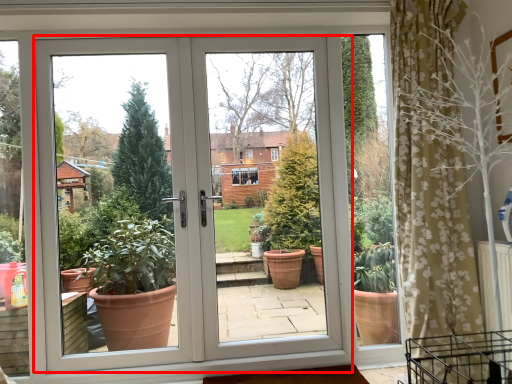
Question: From the image's perspective, where is door (annotated by the red box) located relative to screen door?

Choices:
 (A) below
 (B) above

Answer: (A)